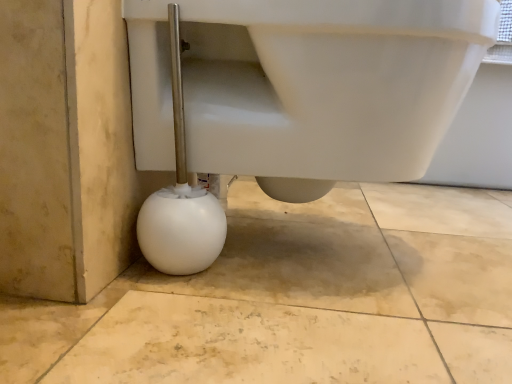
Describe the element at coordinates (302, 87) in the screenshot. Image resolution: width=512 pixels, height=384 pixels. I see `white glossy toilet at lower left` at that location.

At what (x,y) coordinates should I click in order to perform the action: click on white glossy toilet at lower left. Please return your answer as a coordinate pair (x, y). The height and width of the screenshot is (384, 512). Looking at the image, I should click on (302, 87).

Locate an element on the screen. The image size is (512, 384). white glossy toilet at lower left is located at coordinates (302, 87).